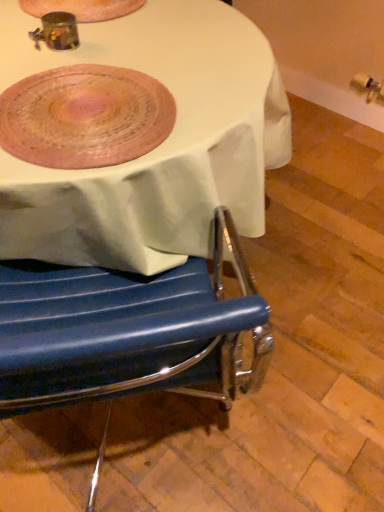
Question: Is blue leather chair at lower left positioned beyond the bounds of pink woven platter at upper left?

Choices:
 (A) yes
 (B) no

Answer: (A)

Question: From the image's perspective, is blue leather chair at lower left over pink woven platter at upper left?

Choices:
 (A) no
 (B) yes

Answer: (A)

Question: Is blue leather chair at lower left behind pink woven platter at upper left?

Choices:
 (A) no
 (B) yes

Answer: (B)

Question: Is blue leather chair at lower left looking in the opposite direction of pink woven platter at upper left?

Choices:
 (A) yes
 (B) no

Answer: (B)

Question: Is blue leather chair at lower left at the left side of pink woven platter at upper left?

Choices:
 (A) no
 (B) yes

Answer: (A)

Question: Is pink woven platter at upper left a part of blue leather chair at lower left?

Choices:
 (A) yes
 (B) no

Answer: (B)

Question: From the image's perspective, is pink woven platter at upper left beneath blue leather chair at lower left?

Choices:
 (A) yes
 (B) no

Answer: (B)

Question: Can you confirm if pink woven platter at upper left is thinner than blue leather chair at lower left?

Choices:
 (A) yes
 (B) no

Answer: (A)

Question: Is pink woven platter at upper left beside blue leather chair at lower left?

Choices:
 (A) yes
 (B) no

Answer: (B)

Question: Is there a large distance between pink woven platter at upper left and blue leather chair at lower left?

Choices:
 (A) no
 (B) yes

Answer: (A)

Question: Is pink woven platter at upper left closer to the viewer compared to blue leather chair at lower left?

Choices:
 (A) no
 (B) yes

Answer: (B)

Question: From the image's perspective, is pink woven platter at upper left on blue leather chair at lower left?

Choices:
 (A) yes
 (B) no

Answer: (A)

Question: From a real-world perspective, is blue leather chair at lower left positioned above or below pink woven platter at upper left?

Choices:
 (A) above
 (B) below

Answer: (B)